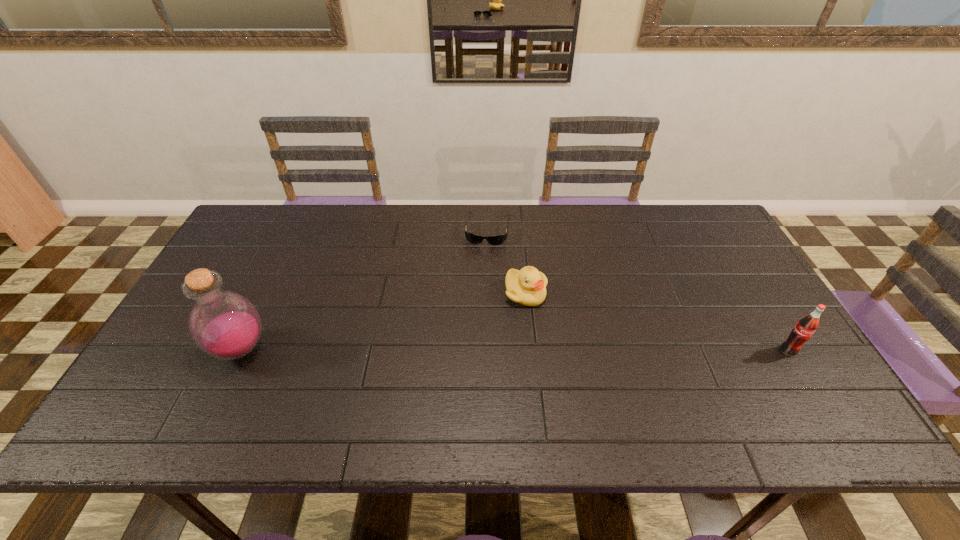
Identify the location of the tallest object. pyautogui.click(x=225, y=325).

Find the location of `bottle`. bottle is located at coordinates (225, 325).

Identify the location of the rightmost object. pyautogui.click(x=807, y=325).

Locate an element on the screen. soda bottle is located at coordinates (807, 325).

The height and width of the screenshot is (540, 960). I want to click on the shortest object, so click(x=472, y=238).

Where is `sunglasses`? The width and height of the screenshot is (960, 540). sunglasses is located at coordinates (472, 238).

You are a GUI agent. You are given a task and a screenshot of the screen. Output one action in this format:
    pyautogui.click(x=<x>, y=<y>)
    Task: Click on the second farthest object
    This screenshot has height=540, width=960.
    Given the screenshot: What is the action you would take?
    pyautogui.click(x=527, y=286)

Locate an element on the screen. Image resolution: width=960 pixels, height=540 pixels. the third tallest object is located at coordinates (527, 286).

Where is `vacant region located on the right of the bottle`? This screenshot has height=540, width=960. vacant region located on the right of the bottle is located at coordinates (338, 349).

The height and width of the screenshot is (540, 960). In order to click on vacant space situated 0.110m on the label of the second tallest object in this screenshot , I will do `click(816, 396)`.